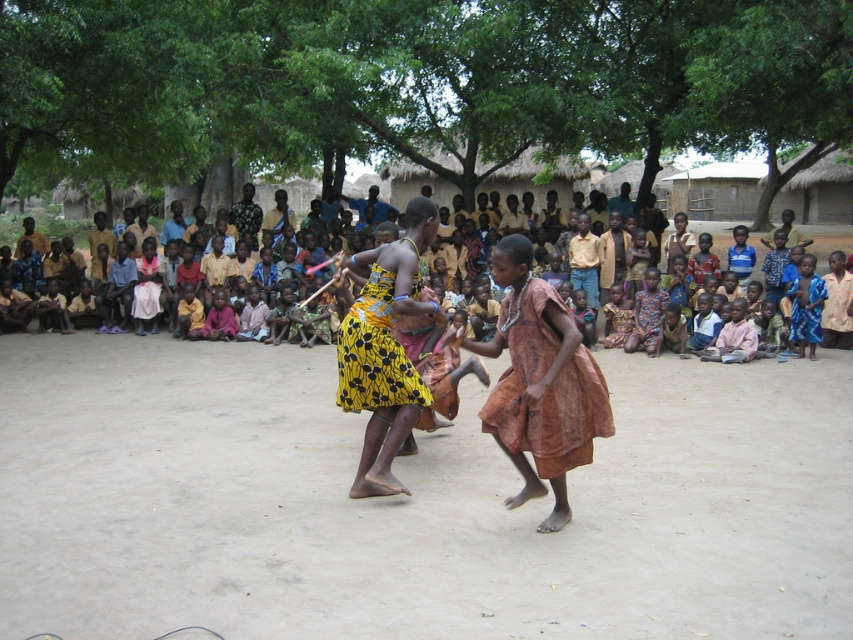
Between yellow printed dress at center and yellow printed fabric dress at center, which one appears on the left side from the viewer's perspective?

yellow printed dress at center is more to the left.

Between point (386, 260) and point (397, 388), which one is positioned in front?

Positioned in front is point (386, 260).

Identify the location of yellow printed dress at center. This screenshot has width=853, height=640. (384, 349).

Which is behind, point (593, 404) or point (347, 368)?

The point (347, 368) is more distant.

Does brown fabric dress at center appear on the right side of yellow printed fabric dress at center?

Indeed, brown fabric dress at center is positioned on the right side of yellow printed fabric dress at center.

Does point (519, 304) come behind point (412, 365)?

No, (519, 304) is in front of (412, 365).

Find the location of `brown fabric dress at center`. brown fabric dress at center is located at coordinates (540, 384).

Can you confirm if brown fabric dress at center is bigger than yellow printed dress at center?

Yes, brown fabric dress at center is bigger than yellow printed dress at center.

Is point (503, 500) positioned after point (399, 442)?

Yes.

Is point (514, 260) behind point (380, 339)?

No, it is in front of (380, 339).

Find the location of a particular element. brown fabric dress at center is located at coordinates (540, 384).